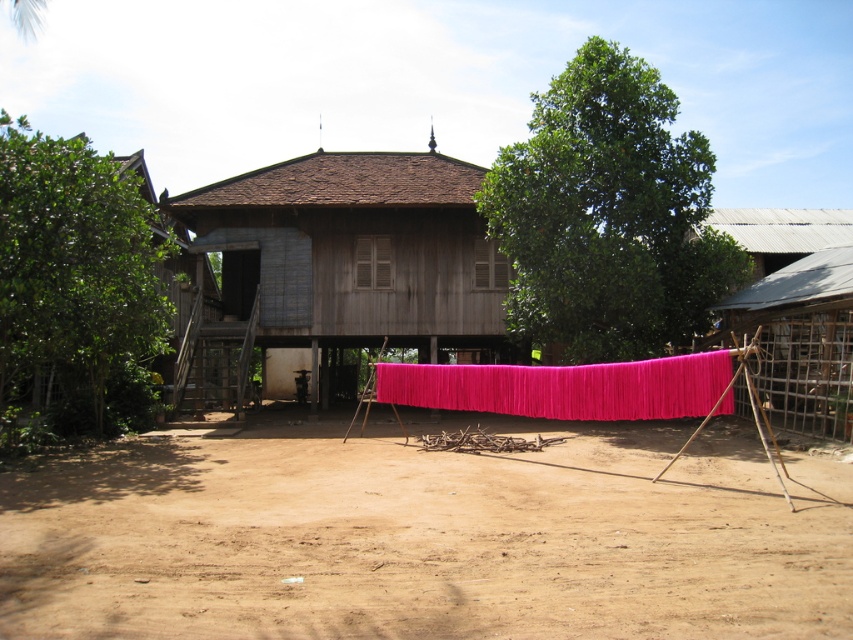
Which is below, pink fabric at right or pink fabric at center?

Positioned lower is pink fabric at right.

Who is shorter, pink fabric at right or pink fabric at center?

pink fabric at center

Is point (828, 396) farther from camera compared to point (520, 371)?

Yes.

The image size is (853, 640). I want to click on pink fabric at right, so click(799, 340).

Between wooden hut at center and pink fabric at center, which one has less height?

pink fabric at center is shorter.

What are the coordinates of `wooden hut at center` in the screenshot? It's located at click(345, 266).

The height and width of the screenshot is (640, 853). I want to click on wooden hut at center, so click(345, 266).

Is brown dirt field at center to the left of pink fabric at center from the viewer's perspective?

Yes, brown dirt field at center is to the left of pink fabric at center.

Is brown dirt field at center wider than pink fabric at center?

Yes.

Measure the distance between brown dirt field at center and camera.

The distance of brown dirt field at center from camera is 4.61 meters.

Find the location of a particular element. brown dirt field at center is located at coordinates [426, 538].